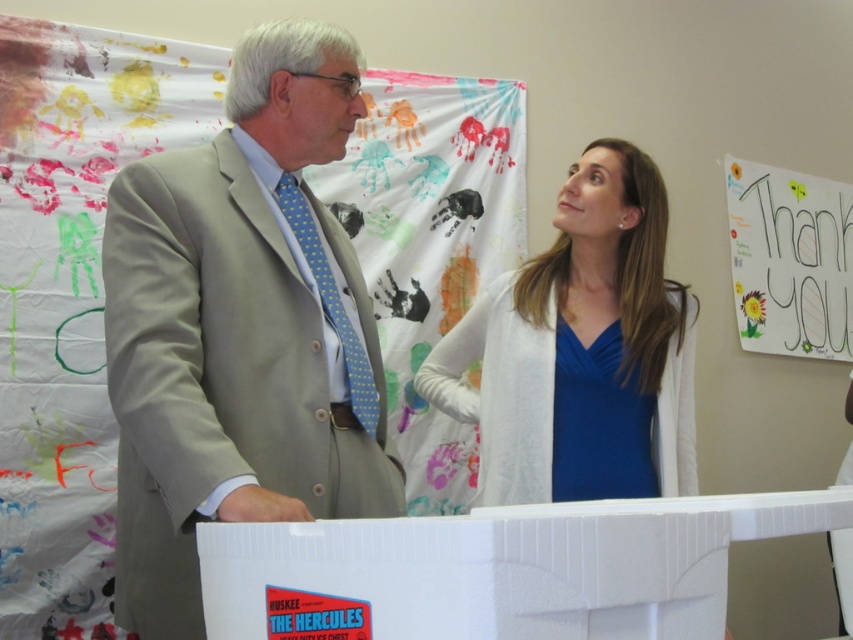
Does white plastic container at center appear on the left side of white paperboard at upper right?

Correct, you'll find white plastic container at center to the left of white paperboard at upper right.

Looking at this image, is the position of white plastic container at center less distant than that of white paperboard at upper right?

Yes, it is.

Identify the location of white plastic container at center. This screenshot has height=640, width=853. (498, 570).

Is light beige suit at center below blue satin blouse at upper center?

Correct, light beige suit at center is located below blue satin blouse at upper center.

Does light beige suit at center come in front of blue satin blouse at upper center?

Yes, light beige suit at center is in front of blue satin blouse at upper center.

Who is more forward, (273, 60) or (556, 401)?

Point (273, 60) is in front.

Where is `light beige suit at center`? Image resolution: width=853 pixels, height=640 pixels. light beige suit at center is located at coordinates (241, 330).

Can you confirm if light beige suit at center is bigger than white paperboard at upper right?

Yes, light beige suit at center is bigger than white paperboard at upper right.

Can you confirm if light beige suit at center is positioned to the right of white paperboard at upper right?

In fact, light beige suit at center is to the left of white paperboard at upper right.

Describe the element at coordinates (241, 330) in the screenshot. I see `light beige suit at center` at that location.

Locate an element on the screen. Image resolution: width=853 pixels, height=640 pixels. light beige suit at center is located at coordinates (241, 330).